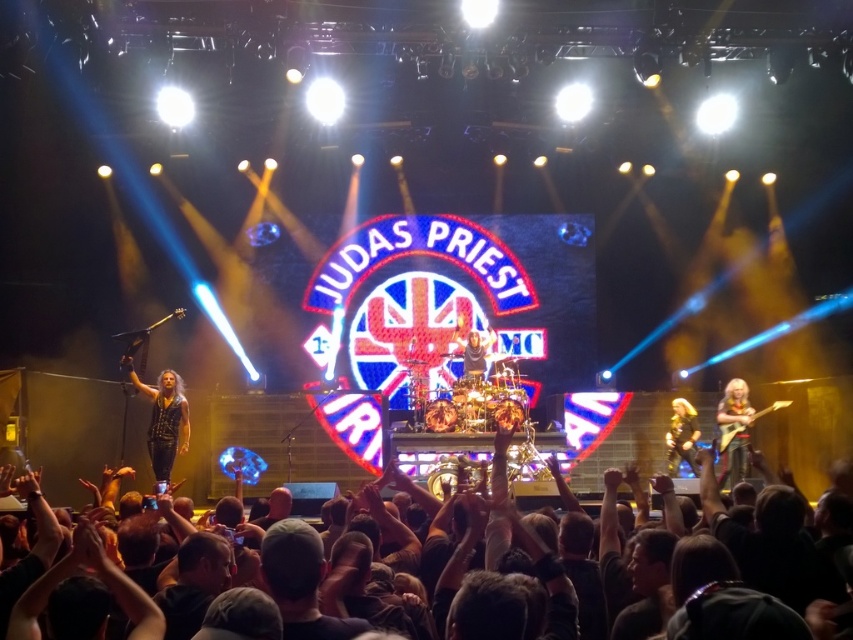
You are a photographer at the Judas Priest concert and want to capture both the shiny gold guitar at right and the shiny black leather jacket at right in a single frame. Given that your camera has a fixed focal length, which object should you position closer to the camera to ensure both fit in the frame?

Since the shiny gold guitar at right is wider than the shiny black leather jacket at right, you should position the shiny gold guitar at right closer to the camera to ensure both fit within the frame. This way, the larger object will take up more space, allowing the smaller one to fit alongside without cropping.

You are a photographer at the Judas Priest concert. You want to take a photo that includes both the shiny gold guitar at right and the shiny black leather jacket at right. Which object should you focus on first to ensure both are in sharp focus?

You should focus on the shiny gold guitar at right first because it is closer to the viewer than the shiny black leather jacket at right. By focusing on the closer object, the depth of field may help keep both in focus.

You are standing at the point labeled point (160, 465) and want to move towards the stage where Judas Priest is performing. Is the point labeled point (671, 428) blocking your path?

Point (160, 465) is in front of point (671, 428), so the point labeled point (671, 428) is behind you and would not block your path to the stage.